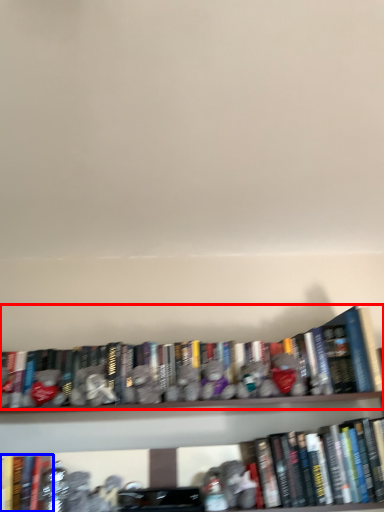
Question: Among these objects, which one is nearest to the camera, book (highlighted by a red box) or book (highlighted by a blue box)?

Choices:
 (A) book
 (B) book

Answer: (B)